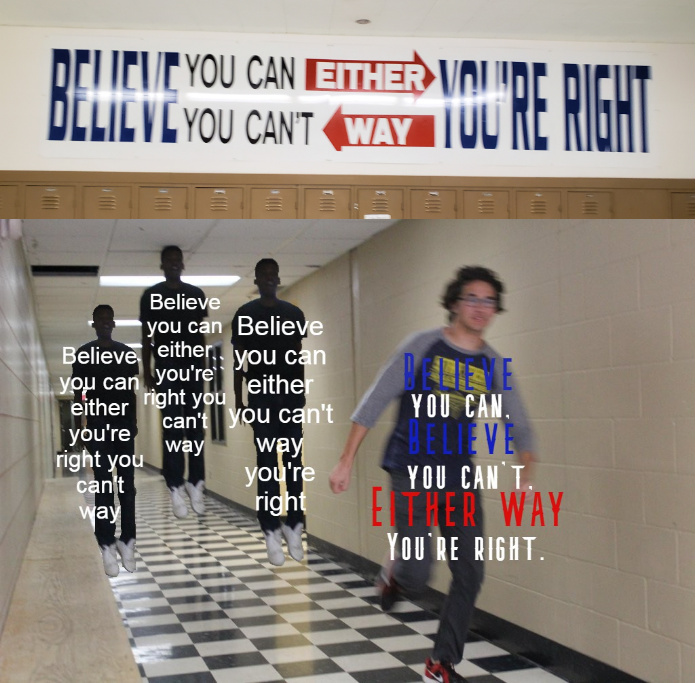
Where is `ceiling`? ceiling is located at coordinates (223, 240).